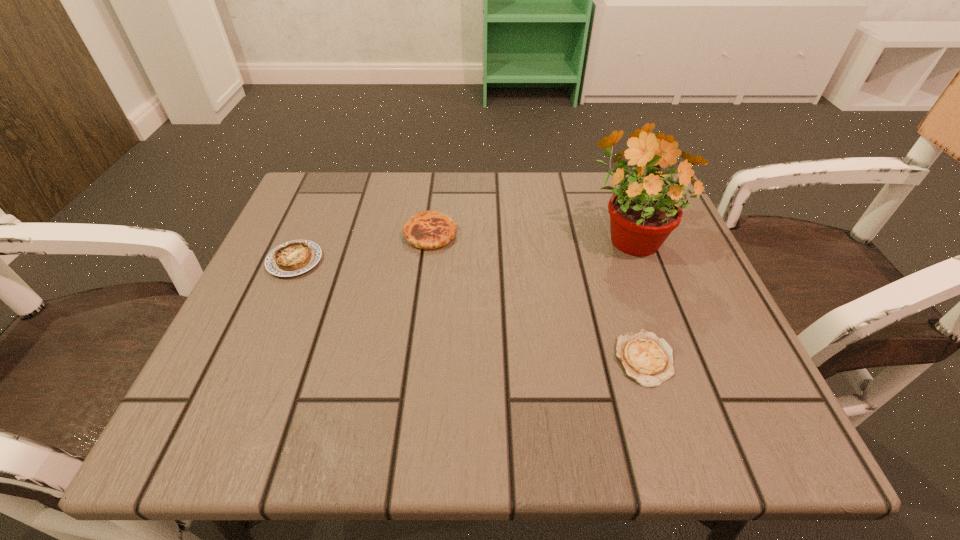
The height and width of the screenshot is (540, 960). What are the coordinates of `vacant space at the far left corner of the desktop` in the screenshot? It's located at (357, 206).

In the image, there is a desktop. Where is `blank space at the near right corner`? Image resolution: width=960 pixels, height=540 pixels. blank space at the near right corner is located at coordinates (705, 436).

The width and height of the screenshot is (960, 540). I want to click on unoccupied position between the tallest object and the second quiche from right to left, so click(529, 234).

Identify the location of vacant region between the flowerpot and the nearest quiche. Image resolution: width=960 pixels, height=540 pixels. (636, 298).

The width and height of the screenshot is (960, 540). In order to click on free space between the tallest quiche and the leftmost quiche in this screenshot , I will do `click(363, 247)`.

Locate an element on the screen. blank region between the tallest object and the rightmost quiche is located at coordinates (636, 298).

What are the coordinates of `free spot between the second object from left to right and the third tallest object` in the screenshot? It's located at (363, 247).

In order to click on vacant space in between the third object from right to left and the leftmost quiche in this screenshot , I will do `click(363, 247)`.

Where is `free point between the tallest object and the leftmost quiche`? This screenshot has width=960, height=540. free point between the tallest object and the leftmost quiche is located at coordinates (462, 248).

Identify the location of vacant space that is in between the second quiche from right to left and the nearest quiche. (538, 296).